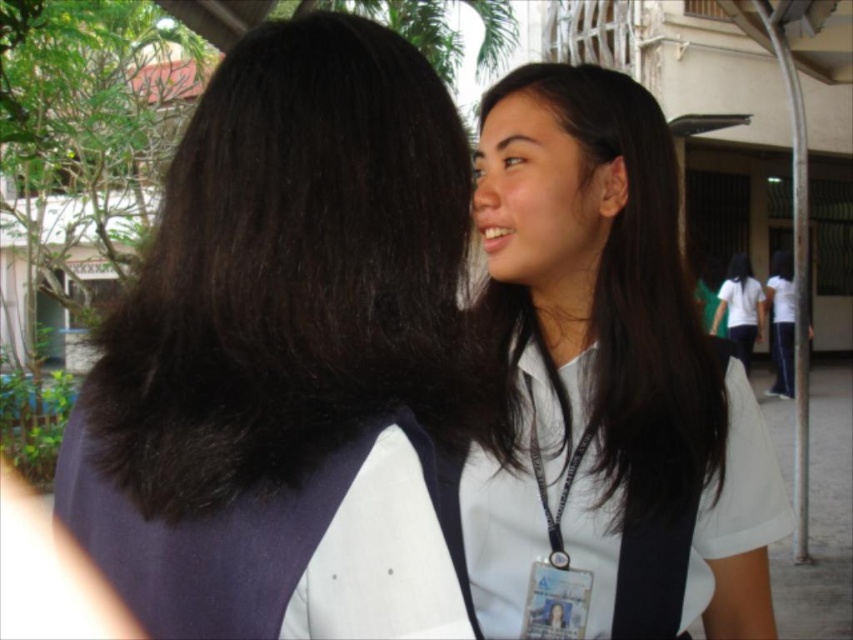
You are standing at the origin of the coordinate system in the image. There is a point at coordinate point (x=288, y=272) which marks dark brown silky hair at upper right. If you want to move towards the dark brown silky hair at upper right, which direction should you move in terms of x and y coordinates?

To move towards the dark brown silky hair at upper right marked at point (x=288, y=272), you should move in the positive x and positive y direction since the point has coordinates greater than the origin.

You are a photographer trying to capture a candid shot of the two people in the scene. You notice the dark brown silky hair at upper right and the white matte shirt at right. Which object is positioned more to the left side of the image?

The dark brown silky hair at upper right is positioned to the left of the white matte shirt at right, so it is more to the left side of the image.

You are a photographer adjusting your camera settings. You want to focus on the dark brown silky hair at upper right and the white matte uniform at center. Which object should you adjust the focus for first if you want to ensure both are in focus?

The dark brown silky hair at upper right is closer to the viewer than the white matte uniform at center. To ensure both are in focus, you should first focus on the dark brown silky hair at upper right since it is closer, and then adjust the focus to include the white matte uniform at center in the depth of field.